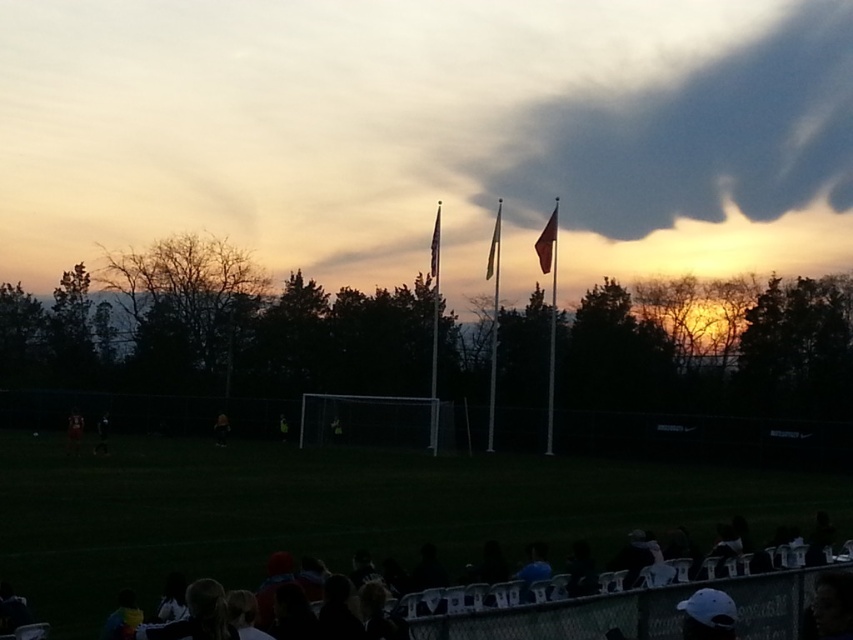
You are a photographer trying to capture the sunset with both the dark gray cloud at upper center and the silky red flag at center in your shot. Which object will appear bigger in your photo?

The dark gray cloud at upper center will appear bigger in the photo because it has a larger size compared to the silky red flag at center.

You are a photographer trying to capture the sunset behind the soccer field. You notice the metallic silver flag pole at center and the white fabric flag at center. Which object should you focus on to ensure it stands out against the sunset backdrop?

The metallic silver flag pole at center is much taller than the white fabric flag at center, so focusing on the metallic silver flag pole at center will ensure it stands out more against the sunset backdrop due to its height.

You are a photographer trying to capture the sunset with both the white plastic chairs at lower center and the metallic silver flag pole at center in your shot. Based on their positions, which object would appear closer to the bottom of the photo?

The white plastic chairs at lower center would appear closer to the bottom of the photo since they are positioned below the metallic silver flag pole at center.